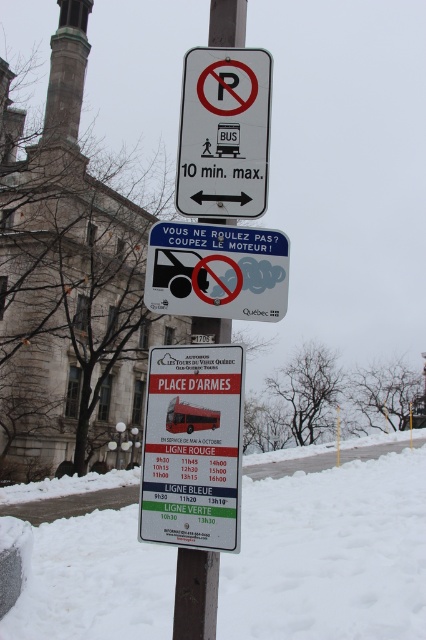
Which is more to the right, white powdery snow at lower center or metallic pole at center?

white powdery snow at lower center

Find the location of a particular element. white powdery snow at lower center is located at coordinates (330, 554).

Describe the element at coordinates (330, 554) in the screenshot. I see `white powdery snow at lower center` at that location.

At what (x,y) coordinates should I click in order to perform the action: click on white powdery snow at lower center. Please return your answer as a coordinate pair (x, y). Looking at the image, I should click on (330, 554).

Can you confirm if white paper sign at center is positioned to the left of metallic pole at center?

Incorrect, white paper sign at center is not on the left side of metallic pole at center.

Does white paper sign at center lie in front of metallic pole at center?

Yes, it is.

Between point (212, 525) and point (216, 563), which one is positioned in front?

Point (212, 525) is more forward.

Locate an element on the screen. white paper sign at center is located at coordinates (192, 448).

Who is more distant from viewer, (192, 404) or (157, 268)?

Point (157, 268)

Is white paper sign at center smaller than white paper bus at center?

No, white paper sign at center is not smaller than white paper bus at center.

You are a GUI agent. You are given a task and a screenshot of the screen. Output one action in this format:
    pyautogui.click(x=<x>, y=<y>)
    Task: Click on the white paper sign at center
    The height and width of the screenshot is (640, 426).
    Given the screenshot: What is the action you would take?
    pyautogui.click(x=192, y=448)